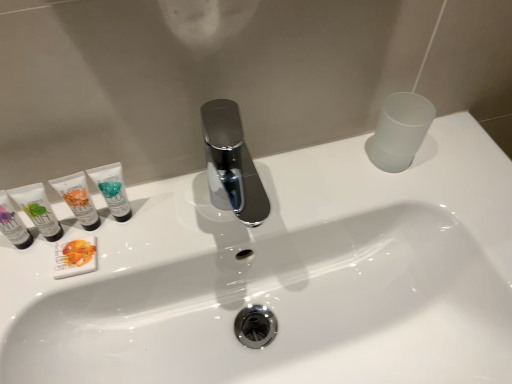
This screenshot has width=512, height=384. Find the location of `free spot to the right of teal matte tube at left, the first toiletry when ordered from right to left`. free spot to the right of teal matte tube at left, the first toiletry when ordered from right to left is located at coordinates (221, 211).